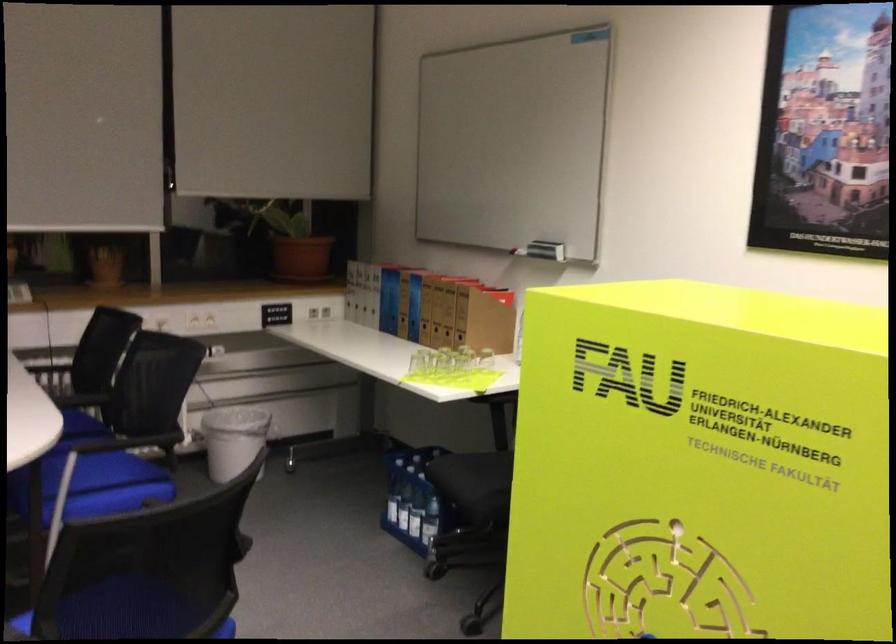
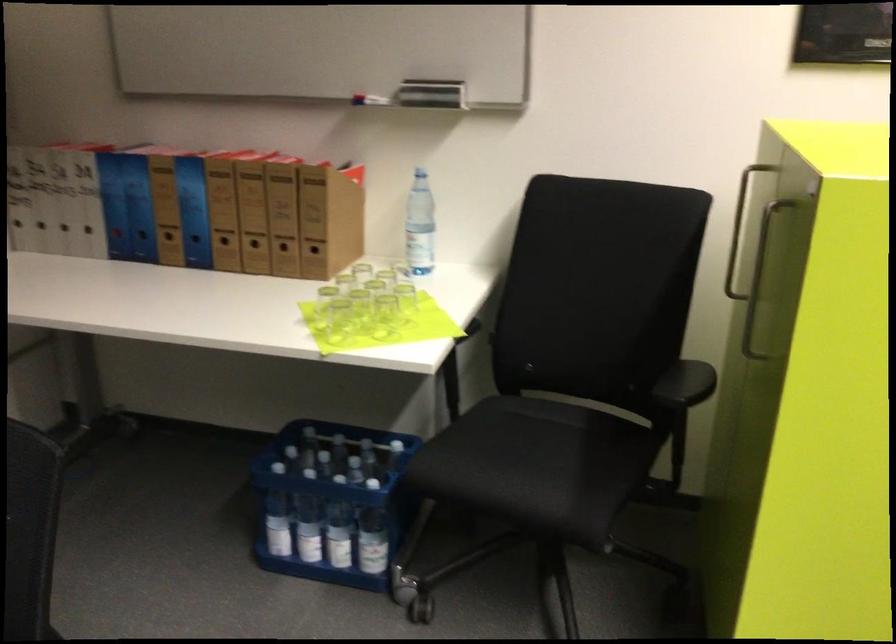
In the second image, find the point that corresponds to (x=426, y=327) in the first image.

(225, 245)